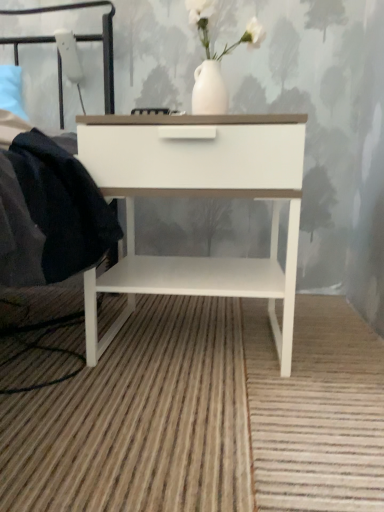
Measure the distance between point (x=284, y=143) and camera.

The distance of point (x=284, y=143) from camera is 32.17 inches.

You are a GUI agent. You are given a task and a screenshot of the screen. Output one action in this format:
    pyautogui.click(x=<x>, y=<y>)
    Task: Click on the white glossy nightstand at center
    The width and height of the screenshot is (384, 512).
    Given the screenshot: What is the action you would take?
    pyautogui.click(x=194, y=195)

Describe the element at coordinates (194, 195) in the screenshot. The image size is (384, 512). I see `white glossy nightstand at center` at that location.

Describe the element at coordinates (89, 41) in the screenshot. I see `black metal headboard at upper left` at that location.

Consider the image. What is the approximate height of black metal headboard at upper left?

black metal headboard at upper left is 18.72 inches in height.

This screenshot has height=512, width=384. I want to click on black metal headboard at upper left, so click(x=89, y=41).

Where is `white glossy nightstand at center`? The image size is (384, 512). white glossy nightstand at center is located at coordinates (194, 195).

Between white glossy nightstand at center and black metal headboard at upper left, which one appears on the right side from the viewer's perspective?

Positioned to the right is white glossy nightstand at center.

Based on the photo, which object is more forward, white glossy nightstand at center or black metal headboard at upper left?

white glossy nightstand at center is more forward.

Does point (170, 150) appear closer or farther from the camera than point (33, 8)?

Point (170, 150).

From the image's perspective, is white glossy nightstand at center on top of black metal headboard at upper left?

No, from the image's perspective, white glossy nightstand at center is not above black metal headboard at upper left.

From a real-world perspective, is white glossy nightstand at center physically located above or below black metal headboard at upper left?

white glossy nightstand at center is situated lower than black metal headboard at upper left in the real world.

Does white glossy nightstand at center have a greater width compared to black metal headboard at upper left?

No, white glossy nightstand at center is not wider than black metal headboard at upper left.

From their relative heights in the image, would you say white glossy nightstand at center is taller or shorter than black metal headboard at upper left?

white glossy nightstand at center is taller than black metal headboard at upper left.

Looking at this image, who is smaller, white glossy nightstand at center or black metal headboard at upper left?

black metal headboard at upper left is smaller.

Could black metal headboard at upper left be considered to be inside white glossy nightstand at center?

No, white glossy nightstand at center does not contain black metal headboard at upper left.

Is white glossy nightstand at center in contact with black metal headboard at upper left?

white glossy nightstand at center is not next to black metal headboard at upper left, and they're not touching.

Is white glossy nightstand at center oriented towards black metal headboard at upper left?

No, white glossy nightstand at center is not oriented towards black metal headboard at upper left.

What's the angular difference between white glossy nightstand at center and black metal headboard at upper left's facing directions?

The angle between the facing direction of white glossy nightstand at center and the facing direction of black metal headboard at upper left is 4.67 degrees.

Image resolution: width=384 pixels, height=512 pixels. I want to click on headboard behind the white glossy nightstand at center, so click(x=89, y=41).

Which is more to the left, black metal headboard at upper left or white glossy nightstand at center?

black metal headboard at upper left.

Is black metal headboard at upper left in front of or behind white glossy nightstand at center in the image?

Clearly, black metal headboard at upper left is behind white glossy nightstand at center.

Which point is more forward, [45,12] or [288,337]?

Point [288,337]

From the image's perspective, relative to white glossy nightstand at center, is black metal headboard at upper left above or below?

Based on their image positions, black metal headboard at upper left is located above white glossy nightstand at center.

From a real-world perspective, is black metal headboard at upper left located beneath white glossy nightstand at center?

Incorrect, from a real-world perspective, black metal headboard at upper left is higher than white glossy nightstand at center.

Can you confirm if black metal headboard at upper left is thinner than white glossy nightstand at center?

In fact, black metal headboard at upper left might be wider than white glossy nightstand at center.

Between black metal headboard at upper left and white glossy nightstand at center, which one has less height?

With less height is black metal headboard at upper left.

Considering the sizes of black metal headboard at upper left and white glossy nightstand at center in the image, is black metal headboard at upper left bigger or smaller than white glossy nightstand at center?

Considering their sizes, black metal headboard at upper left takes up less space than white glossy nightstand at center.

Is white glossy nightstand at center a part of black metal headboard at upper left?

Actually, white glossy nightstand at center is outside black metal headboard at upper left.

Is black metal headboard at upper left next to white glossy nightstand at center?

No.

In the scene shown: Is black metal headboard at upper left looking in the opposite direction of white glossy nightstand at center?

No, black metal headboard at upper left is not facing away from white glossy nightstand at center.

Measure the distance from black metal headboard at upper left to white glossy nightstand at center.

black metal headboard at upper left and white glossy nightstand at center are 70.50 centimeters apart from each other.

Where is `headboard located above the white glossy nightstand at center (from the image's perspective)`? headboard located above the white glossy nightstand at center (from the image's perspective) is located at coordinates (89, 41).

The height and width of the screenshot is (512, 384). I want to click on headboard on the left side of white glossy nightstand at center, so click(x=89, y=41).

I want to click on nightstand that is in front of the black metal headboard at upper left, so click(x=194, y=195).